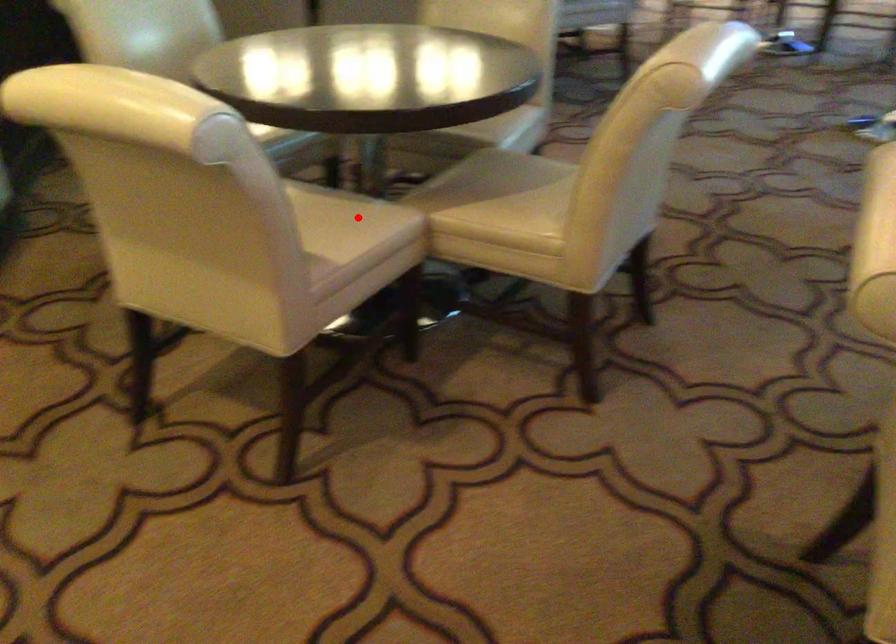
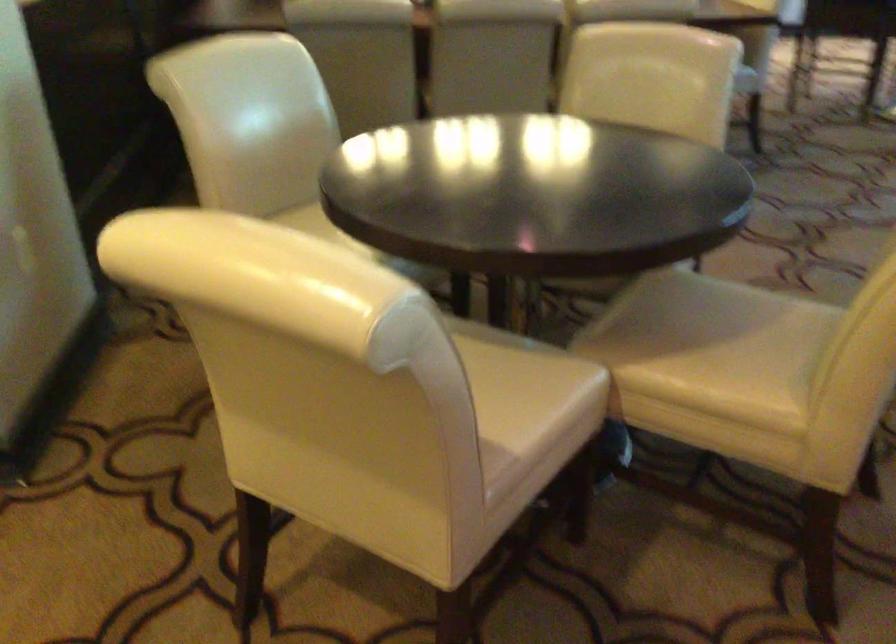
Where in the second image is the point corresponding to the highlighted location from the first image?

(530, 377)